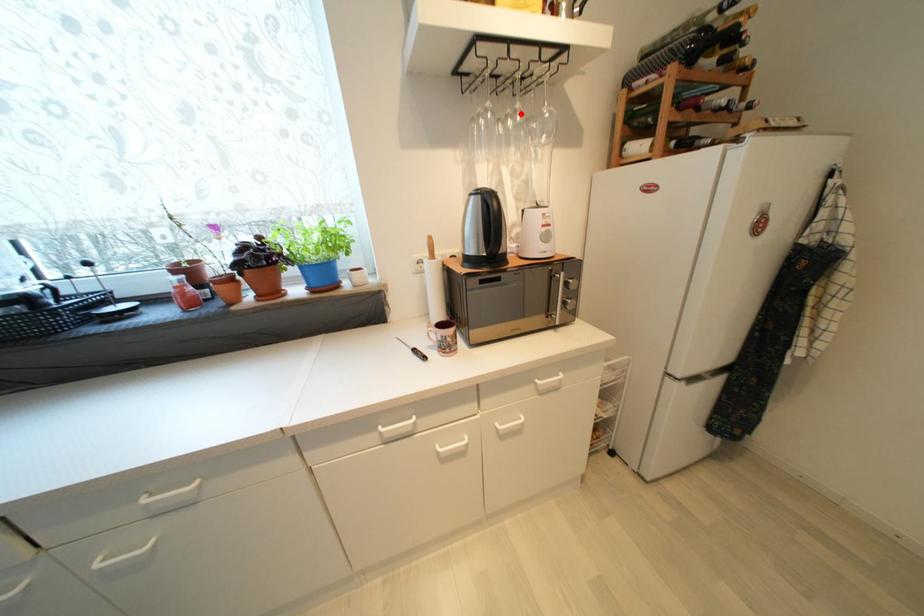
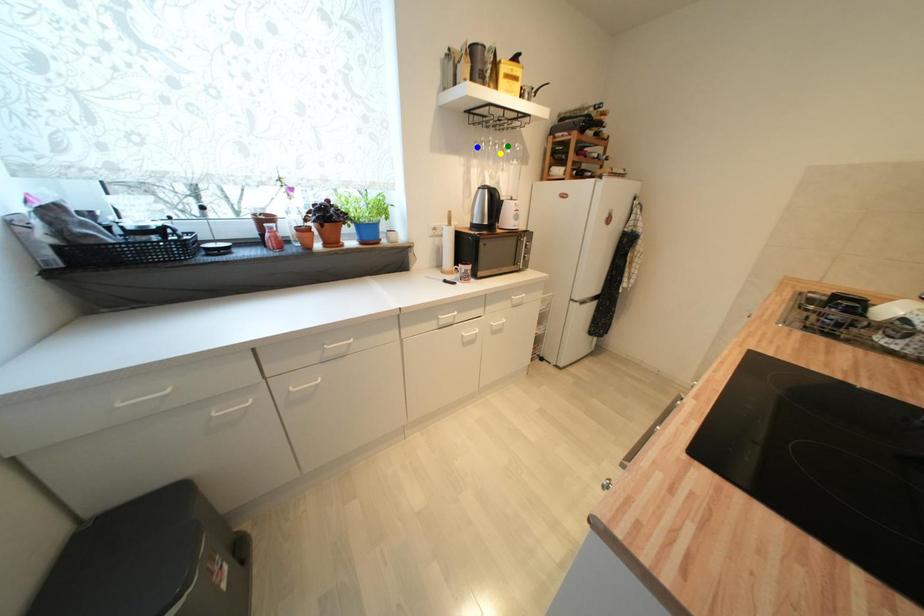
Question: I am providing you with two images of the same scene from different viewpoints. A red point is marked on the first image. You are given multiple points on the second image. In image 2, which mark is for the same physical point as the one in image 1?

Choices:
 (A) yellow point
 (B) blue point
 (C) green point

Answer: (C)